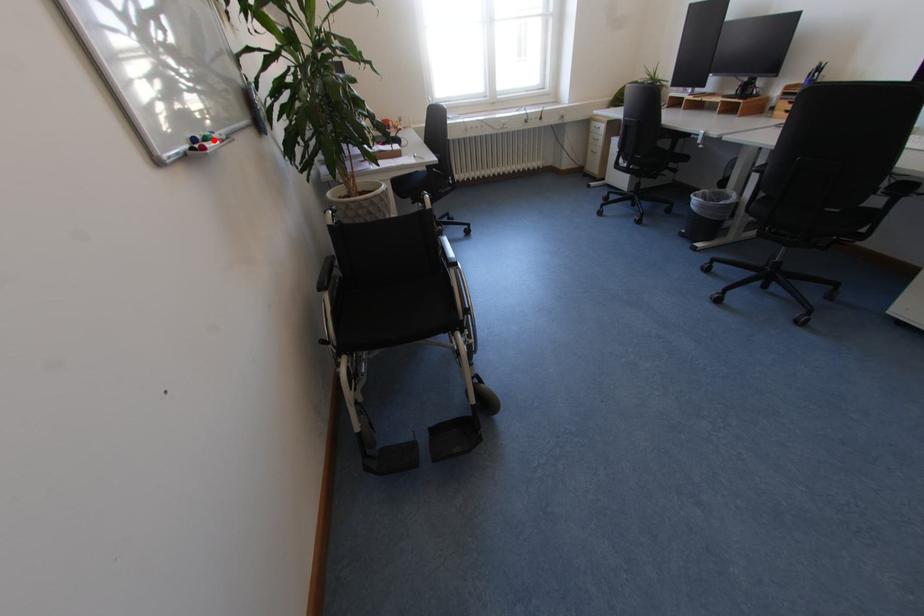
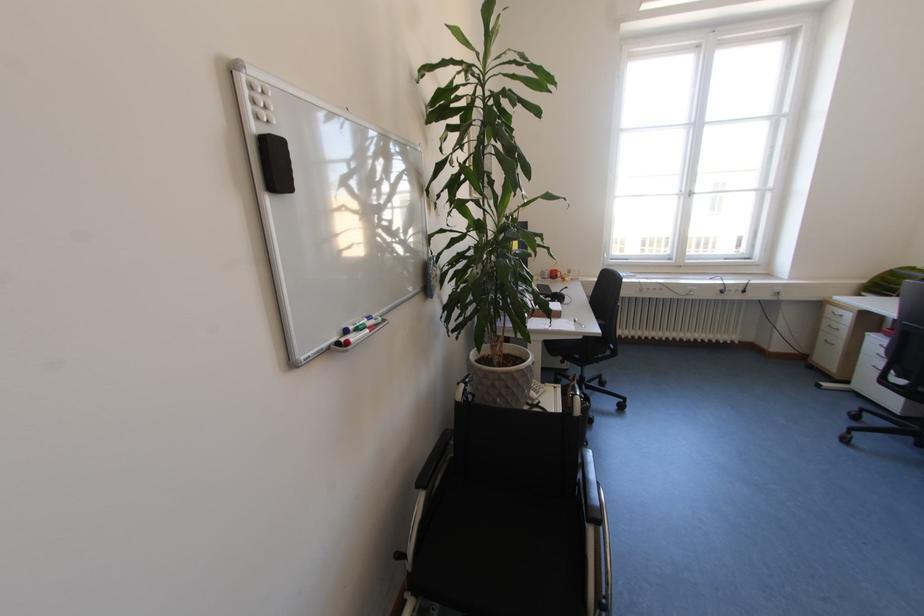
In the second image, find the point that corresponds to the highlighted location in the first image.

(366, 330)